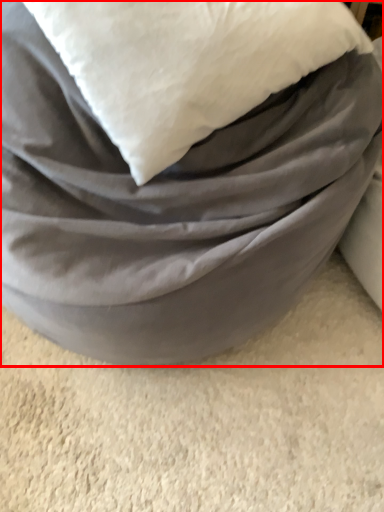
Question: In this image, where is furniture (annotated by the red box) located relative to pillow?

Choices:
 (A) left
 (B) right

Answer: (A)